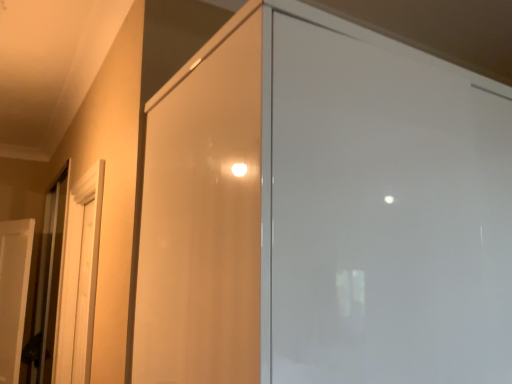
The height and width of the screenshot is (384, 512). Find the location of `white matte door at left`. white matte door at left is located at coordinates (13, 293).

This screenshot has width=512, height=384. I want to click on matte wood screen door at left, the second screen door when ordered from right to left, so click(78, 279).

From the picture: In order to face transparent glass screen door at center, positioned as the second screen door in back-to-front order, should I rotate leftwards or rightwards?

You should rotate right by 15.053 degrees.

The height and width of the screenshot is (384, 512). What do you see at coordinates (386, 217) in the screenshot? I see `transparent glass screen door at center, positioned as the second screen door in back-to-front order` at bounding box center [386, 217].

This screenshot has height=384, width=512. I want to click on white matte door at left, so click(13, 293).

Is metallic elevator door at left taller than matte wood screen door at left, marked as the 1th screen door in a left-to-right arrangement?

Yes, metallic elevator door at left is taller than matte wood screen door at left, marked as the 1th screen door in a left-to-right arrangement.

Would you say metallic elevator door at left is to the left or to the right of matte wood screen door at left, the 1th screen door positioned from the back, in the picture?

In the image, metallic elevator door at left appears on the left side of matte wood screen door at left, the 1th screen door positioned from the back.

Which of these two, metallic elevator door at left or matte wood screen door at left, the second screen door positioned from the front, is bigger?

metallic elevator door at left is bigger.

Which object is further away from the camera taking this photo, transparent glass screen door at center, the first screen door in the right-to-left sequence, or metallic elevator door at left?

metallic elevator door at left is more distant.

From the image's perspective, who appears lower, transparent glass screen door at center, positioned as the second screen door in back-to-front order, or metallic elevator door at left?

metallic elevator door at left, from the image's perspective.

Considering the sizes of transparent glass screen door at center, positioned as the second screen door in back-to-front order, and metallic elevator door at left in the image, is transparent glass screen door at center, positioned as the second screen door in back-to-front order, taller or shorter than metallic elevator door at left?

Clearly, transparent glass screen door at center, positioned as the second screen door in back-to-front order, is shorter compared to metallic elevator door at left.

Is transparent glass screen door at center, the first screen door positioned from the front, in contact with metallic elevator door at left?

transparent glass screen door at center, the first screen door positioned from the front, and metallic elevator door at left are not in contact.

Is white matte door at left next to matte wood screen door at left, marked as the 1th screen door in a left-to-right arrangement, and touching it?

white matte door at left and matte wood screen door at left, marked as the 1th screen door in a left-to-right arrangement, are not in contact.

From the image's perspective, count 1st screen doors upward from the white matte door at left and point to it. Please provide its 2D coordinates.

[(78, 279)]

In the scene shown: Is white matte door at left completely or partially outside of matte wood screen door at left, the second screen door positioned from the front?

That's correct, white matte door at left is outside of matte wood screen door at left, the second screen door positioned from the front.

Considering the relative positions of matte wood screen door at left, marked as the 1th screen door in a left-to-right arrangement, and white matte door at left in the image provided, is matte wood screen door at left, marked as the 1th screen door in a left-to-right arrangement, behind white matte door at left?

No, it is in front of white matte door at left.

Is matte wood screen door at left, the 1th screen door positioned from the back, bigger or smaller than white matte door at left?

Clearly, matte wood screen door at left, the 1th screen door positioned from the back, is smaller in size than white matte door at left.

Could you measure the distance between matte wood screen door at left, the second screen door when ordered from right to left, and white matte door at left?

A distance of 3.44 feet exists between matte wood screen door at left, the second screen door when ordered from right to left, and white matte door at left.

Which point is more forward, [65,275] or [11,324]?

The point [65,275] is closer to the camera.

Is white matte door at left directly adjacent to metallic elevator door at left?

No, white matte door at left is not next to metallic elevator door at left.

Which is behind, point (6, 352) or point (46, 251)?

The point (46, 251) is more distant.

Considering the sizes of objects white matte door at left and metallic elevator door at left in the image provided, who is bigger, white matte door at left or metallic elevator door at left?

Bigger between the two is metallic elevator door at left.

Image resolution: width=512 pixels, height=384 pixels. Find the location of `elevator on the left side of matte wood screen door at left, marked as the 1th screen door in a left-to-right arrangement`. elevator on the left side of matte wood screen door at left, marked as the 1th screen door in a left-to-right arrangement is located at coordinates (47, 286).

From a real-world perspective, is matte wood screen door at left, the second screen door when ordered from right to left, under metallic elevator door at left?

Actually, matte wood screen door at left, the second screen door when ordered from right to left, is physically above metallic elevator door at left in the real world.

Who is shorter, matte wood screen door at left, the second screen door when ordered from right to left, or metallic elevator door at left?

matte wood screen door at left, the second screen door when ordered from right to left.

From the image's perspective, is metallic elevator door at left over white matte door at left?

Indeed, from the image's perspective, metallic elevator door at left is shown above white matte door at left.

Is metallic elevator door at left completely or partially outside of white matte door at left?

Absolutely, metallic elevator door at left is external to white matte door at left.

Locate an element on the screen. Image resolution: width=512 pixels, height=384 pixels. elevator above the white matte door at left (from the image's perspective) is located at coordinates (47, 286).

Could you tell me if metallic elevator door at left is facing white matte door at left?

Yes, metallic elevator door at left is turned towards white matte door at left.

The height and width of the screenshot is (384, 512). Find the location of `elevator located behind the matte wood screen door at left, the 1th screen door positioned from the back`. elevator located behind the matte wood screen door at left, the 1th screen door positioned from the back is located at coordinates [47, 286].

From the image's perspective, which screen door is the 2nd one above the metallic elevator door at left? Please provide its 2D coordinates.

[(386, 217)]

Considering their positions, is matte wood screen door at left, the second screen door when ordered from right to left, positioned closer to transparent glass screen door at center, the first screen door positioned from the front, than metallic elevator door at left?

matte wood screen door at left, the second screen door when ordered from right to left, is closer to transparent glass screen door at center, the first screen door positioned from the front.

When comparing their distances from transparent glass screen door at center, the first screen door positioned from the front, does white matte door at left or metallic elevator door at left seem closer?

Among the two, metallic elevator door at left is located nearer to transparent glass screen door at center, the first screen door positioned from the front.

From the image, which object appears to be farther from white matte door at left, matte wood screen door at left, the second screen door positioned from the front, or transparent glass screen door at center, the first screen door positioned from the front?

Among the two, transparent glass screen door at center, the first screen door positioned from the front, is located further to white matte door at left.

Considering their positions, is matte wood screen door at left, the second screen door when ordered from right to left, positioned further to white matte door at left than metallic elevator door at left?

matte wood screen door at left, the second screen door when ordered from right to left, is further to white matte door at left.

Estimate the real-world distances between objects in this image. Which object is further from matte wood screen door at left, the 1th screen door positioned from the back, white matte door at left or metallic elevator door at left?

white matte door at left is positioned further to the anchor matte wood screen door at left, the 1th screen door positioned from the back.

Based on their spatial positions, is white matte door at left or transparent glass screen door at center, positioned as the second screen door in back-to-front order, closer to metallic elevator door at left?

white matte door at left lies closer to metallic elevator door at left than the other object.

Considering their positions, is metallic elevator door at left positioned closer to matte wood screen door at left, the second screen door positioned from the front, than white matte door at left?

The object closer to matte wood screen door at left, the second screen door positioned from the front, is metallic elevator door at left.

Which object lies further to the anchor point white matte door at left, transparent glass screen door at center, the 2th screen door when ordered from left to right, or matte wood screen door at left, the 1th screen door positioned from the back?

transparent glass screen door at center, the 2th screen door when ordered from left to right, is positioned further to the anchor white matte door at left.

Find the location of a particular element. The image size is (512, 384). elevator between matte wood screen door at left, the 1th screen door positioned from the back, and white matte door at left from front to back is located at coordinates (47, 286).

You are a GUI agent. You are given a task and a screenshot of the screen. Output one action in this format:
    pyautogui.click(x=<x>, y=<y>)
    Task: Click on the screen door positioned between transparent glass screen door at center, the first screen door in the right-to-left sequence, and white matte door at left from near to far
    
    Given the screenshot: What is the action you would take?
    pyautogui.click(x=78, y=279)

Image resolution: width=512 pixels, height=384 pixels. Find the location of `screen door located between transparent glass screen door at center, the first screen door positioned from the front, and metallic elevator door at left in the depth direction`. screen door located between transparent glass screen door at center, the first screen door positioned from the front, and metallic elevator door at left in the depth direction is located at coordinates (78, 279).

The height and width of the screenshot is (384, 512). What are the coordinates of `elevator between transparent glass screen door at center, positioned as the second screen door in back-to-front order, and white matte door at left in the front-back direction` in the screenshot? It's located at (47, 286).